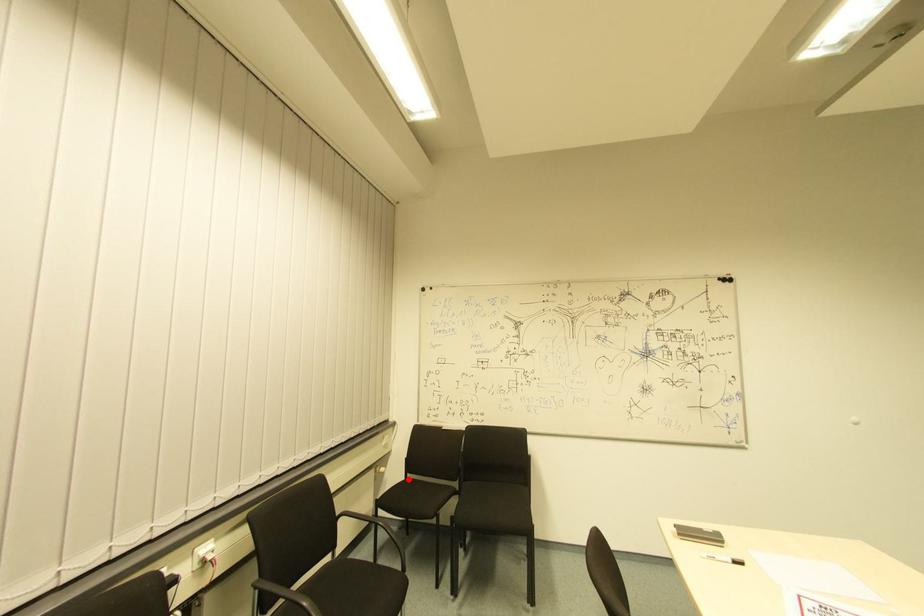
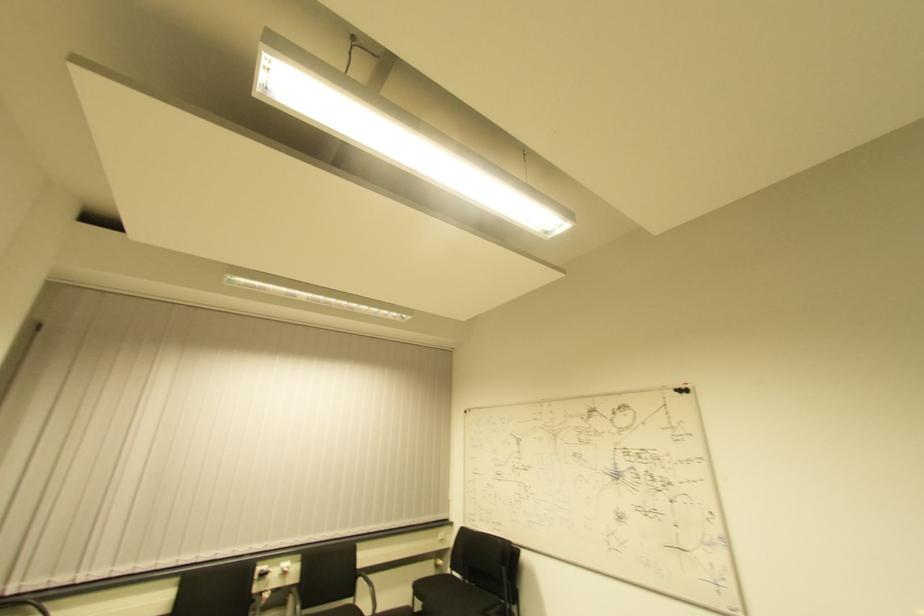
Locate, in the second image, the point that corresponds to the highlighted location in the first image.

(454, 576)